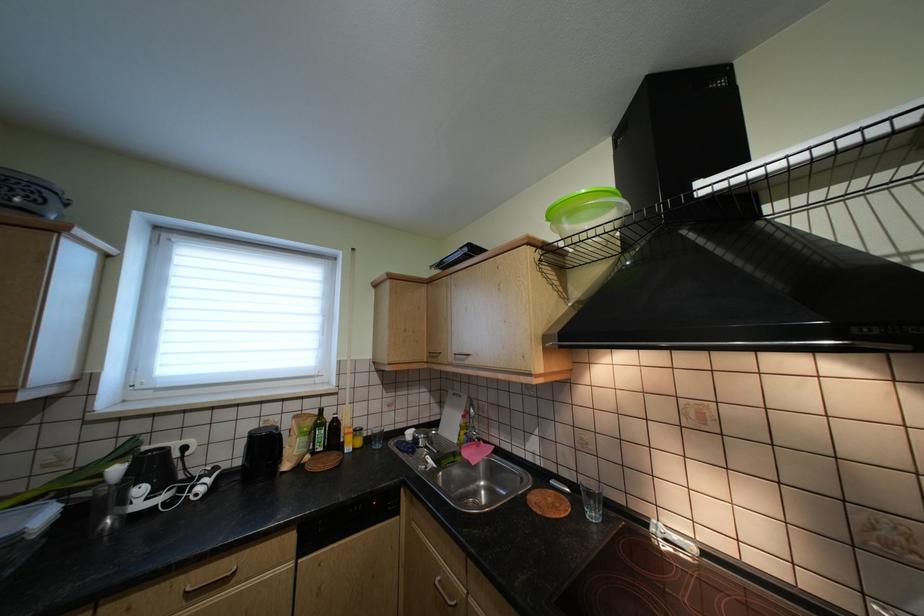
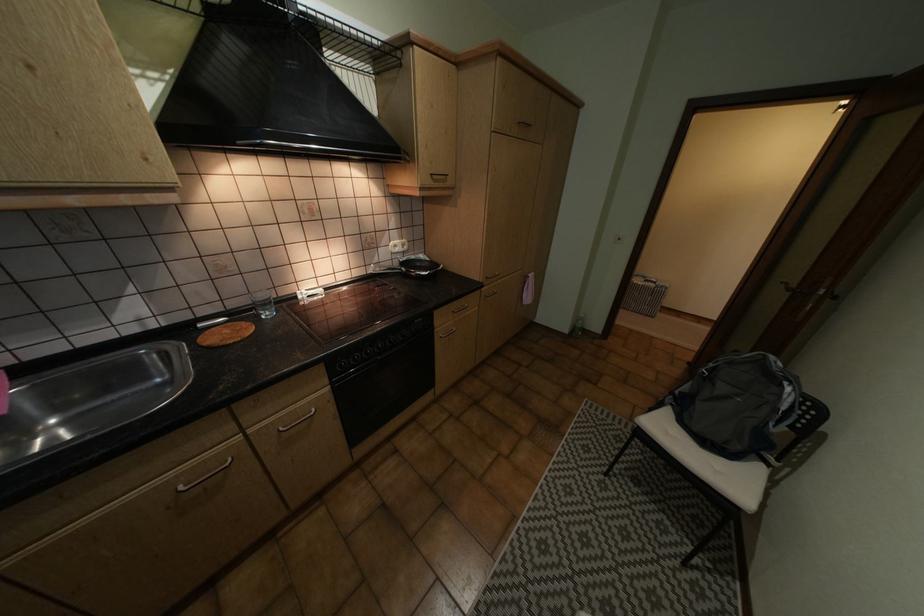
Based on the continuous images, in which direction is the camera rotating?

The camera rotated toward right-down.